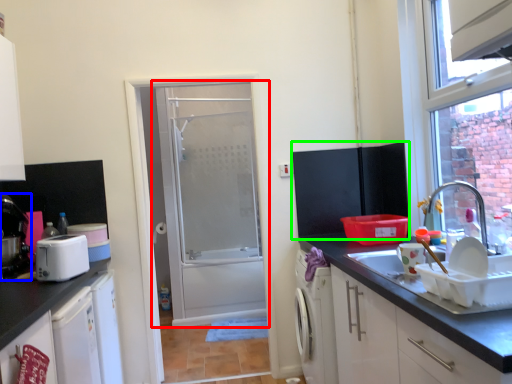
Question: Estimate the real-world distances between objects in this image. Which object is farther from door (highlighted by a red box), coffee machine (highlighted by a blue box) or wide (highlighted by a green box)?

Choices:
 (A) coffee machine
 (B) wide

Answer: (A)